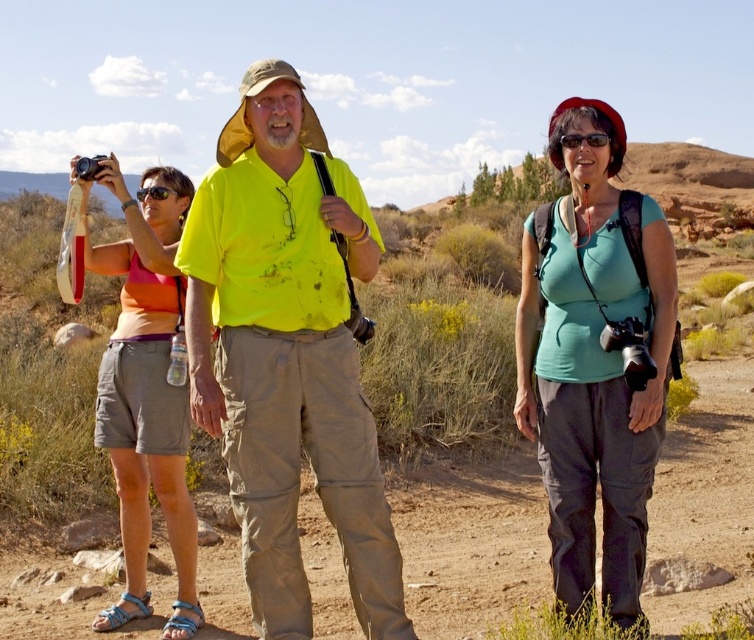
You are a photographer trying to decide where to place your equipment. The yellow matte shirt at center and the black plastic sunglasses at center are in the frame. Which object takes up more horizontal space in the photo?

The yellow matte shirt at center takes up more horizontal space in the photo because its width is larger than that of the black plastic sunglasses at center.

You are a photographer planning to take a group photo of the two people in the scene. The yellow matte shirt at center and the teal fabric shirt at center are standing close to each other. Which person should you focus on first if you want to ensure both are in focus, considering their sizes?

You should focus on the yellow matte shirt at center first because it is larger in size than the teal fabric shirt at center, so focusing on the larger subject increases the likelihood of both being in focus.

You are standing at the point labeled point (351, 580) and want to walk to the point labeled point (578, 212). Which direction should you move in to get closer to your destination?

You should move in the direction away from the camera because point (578, 212) is farther from the camera than point (351, 580).